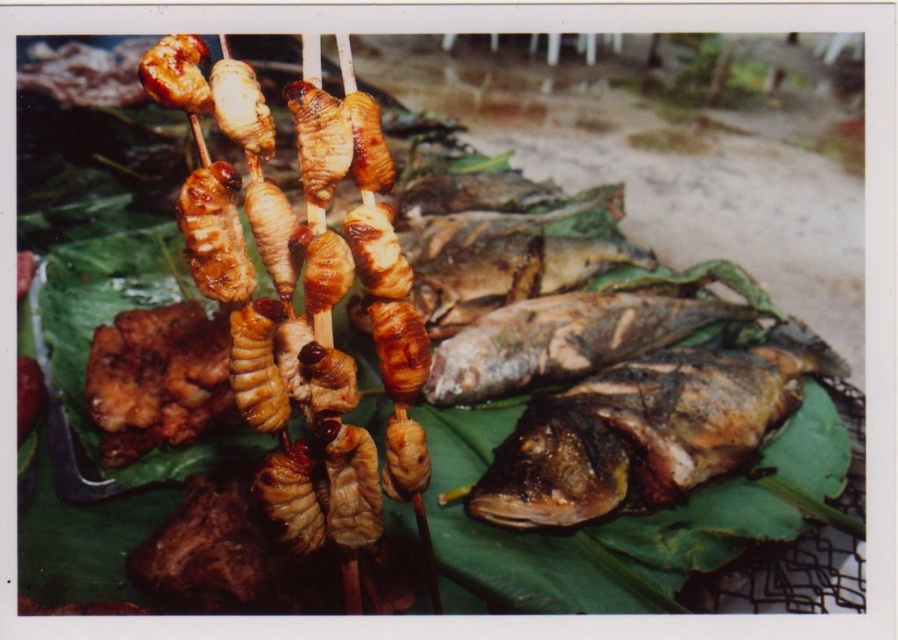
Question: Can you confirm if golden-brown crispy fish at center is positioned above brownish matte fish at center?

Choices:
 (A) yes
 (B) no

Answer: (B)

Question: Does golden-brown crispy fish at center appear over brownish matte fish at center?

Choices:
 (A) no
 (B) yes

Answer: (A)

Question: Does golden-brown crispy fish at center have a greater width compared to brownish matte fish at center?

Choices:
 (A) no
 (B) yes

Answer: (B)

Question: Which of the following is the farthest from the observer?

Choices:
 (A) golden-brown crispy fish at center
 (B) brownish matte fish at center

Answer: (B)

Question: Which of the following is the closest to the observer?

Choices:
 (A) golden-brown crispy fish at center
 (B) brownish matte fish at center

Answer: (A)